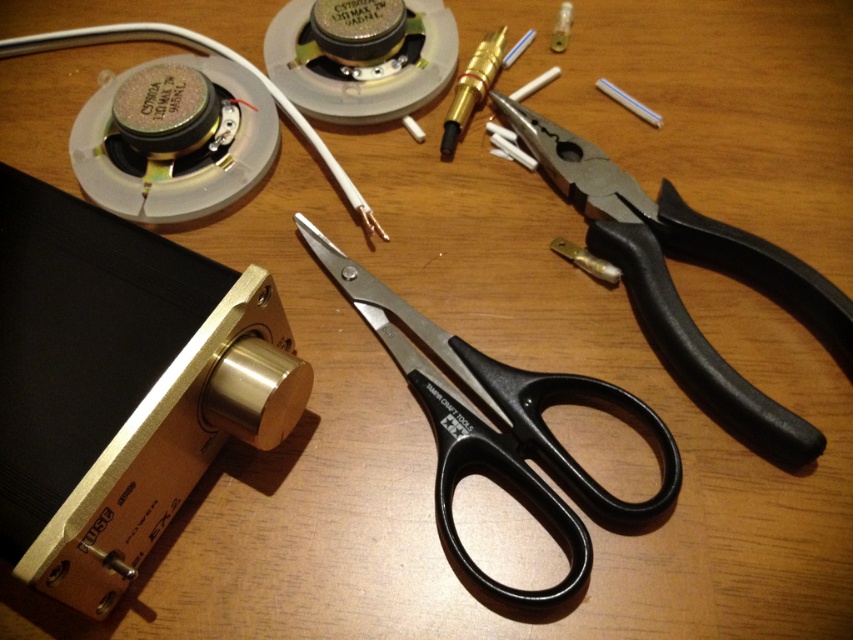
You are an electrician working on the table and need to connect a new wire to the gold metallic knob at center. However, there is a white matte wire at upper left nearby. Which object should you avoid moving to prevent disrupting the existing connections?

You should avoid moving the white matte wire at upper left because it is positioned to the right of the gold metallic knob at center, so disturbing it might affect the existing connections near the knob.

You are organizing tools on a table and need to place the black plastic pliers at upper right. Where should you place them relative to the gold metallic knob at center?

The black plastic pliers at upper right should be placed to the right of the gold metallic knob at center since the gold metallic knob at center is to the left of black plastic pliers at upper right.

What is the location of the point with coordinates [120,385] in relation to the gold metallic knob at center?

The point with coordinates [120,385] is located on the gold metallic knob at center.